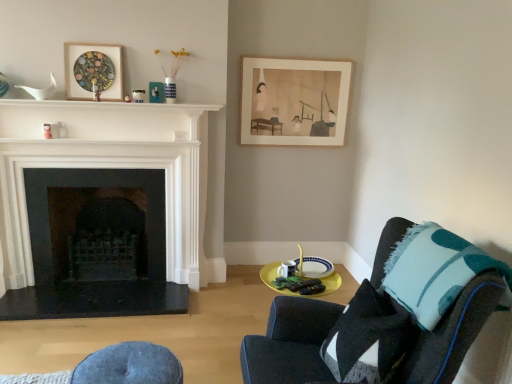
At what (x,y) coordinates should I click in order to perform the action: click on vacant space situated above matte paper picture frame at upper center, placed as the third picture frame when sorted from left to right (from a real-world perspective). Please return your answer as a coordinate pair (x, y). Image resolution: width=512 pixels, height=384 pixels. Looking at the image, I should click on (300, 61).